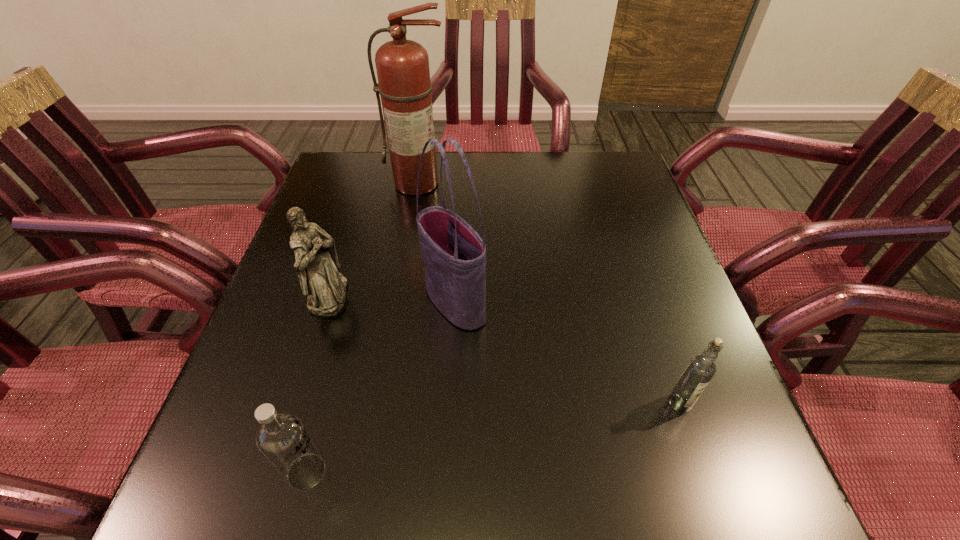
This screenshot has height=540, width=960. I want to click on the tallest object, so click(x=402, y=66).

This screenshot has width=960, height=540. In order to click on the farthest object in this screenshot , I will do `click(402, 66)`.

The width and height of the screenshot is (960, 540). Identify the location of the fourth shortest object. (454, 255).

Locate an element on the screen. figurine is located at coordinates (317, 265).

Locate an element on the screen. The height and width of the screenshot is (540, 960). the nearer vodka is located at coordinates (282, 438).

Find the location of `the left vodka`. the left vodka is located at coordinates (282, 438).

This screenshot has height=540, width=960. Identify the location of the farther vodka. (699, 371).

Locate an element on the screen. the right vodka is located at coordinates (699, 371).

Locate an element on the screen. This screenshot has height=540, width=960. vacant region located 0.120m on the front-facing side of the fire extinguisher is located at coordinates (411, 225).

At what (x,y) coordinates should I click in order to perform the action: click on vacant area situated 0.120m on the right of the tote bag. Please return your answer as a coordinate pair (x, y). This screenshot has width=960, height=540. Looking at the image, I should click on (542, 302).